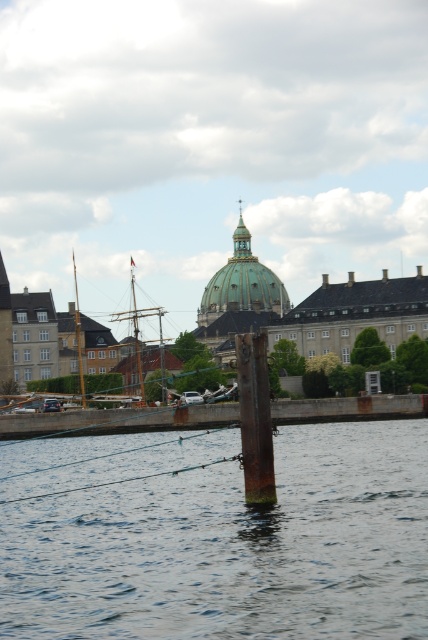
Who is more forward, (36, 419) or (234, 228)?

Point (36, 419)

What do you see at coordinates (118, 420) in the screenshot? I see `rusty metal dock at center` at bounding box center [118, 420].

You are a GUI agent. You are given a task and a screenshot of the screen. Output one action in this format:
    pyautogui.click(x=<x>, y=<y>)
    Task: Click on the rusty metal dock at center
    Image resolution: width=428 pixels, height=640 pixels.
    Given the screenshot: What is the action you would take?
    pyautogui.click(x=118, y=420)

Find the location of a particular element. This screenshot has height=640, width=428. rusty metal dock at center is located at coordinates (118, 420).

Who is higher up, rusty metal post at lower center or rusty metal dock at center?

rusty metal dock at center is higher up.

Does rusty metal post at lower center have a greater width compared to rusty metal dock at center?

No.

Which is in front, point (130, 618) or point (404, 400)?

Point (130, 618) is in front.

Where is `rusty metal post at lower center`? The image size is (428, 640). rusty metal post at lower center is located at coordinates (216, 536).

Which is in front, point (220, 520) or point (219, 310)?

Point (220, 520)

The height and width of the screenshot is (640, 428). In order to click on rusty metal post at lower center in this screenshot , I will do `click(216, 536)`.

Who is more distant from viewer, (419, 493) or (228, 300)?

Point (228, 300)

Where is `rusty metal post at lower center`? rusty metal post at lower center is located at coordinates (216, 536).